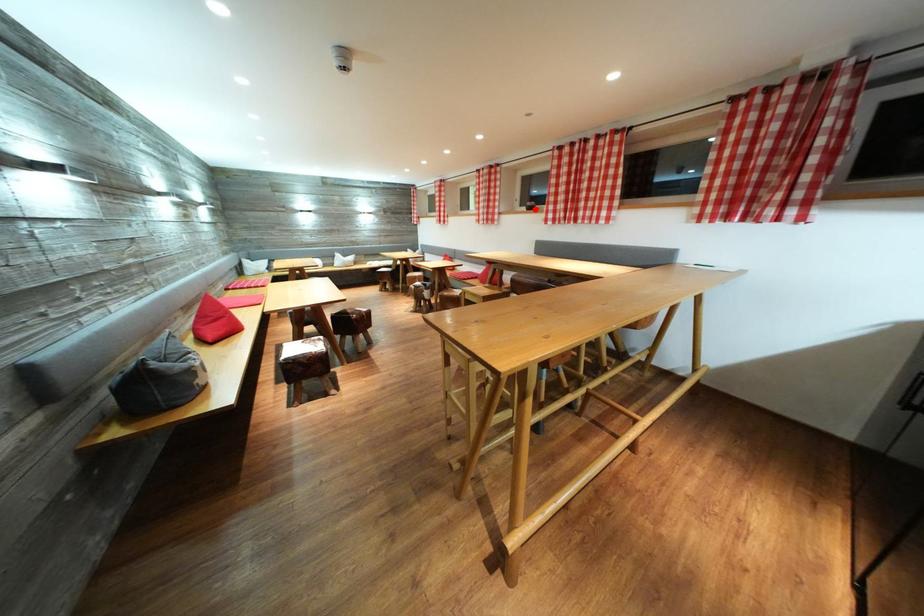
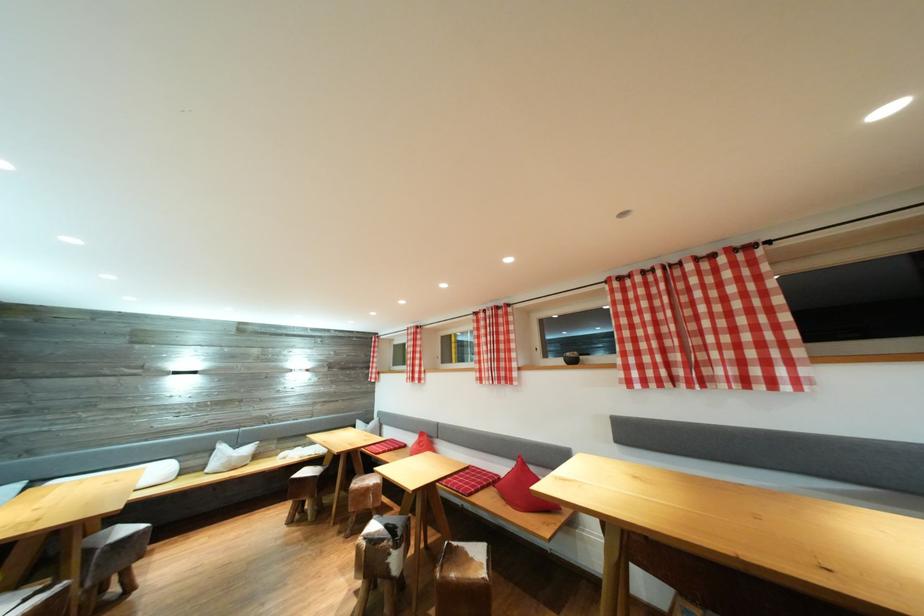
Question: I am providing you with two images of the same scene from different viewpoints. A red point is shown in image1. For the corresponding object point in image2, is it positioned nearer or farther from the camera?

Choices:
 (A) Nearer
 (B) Farther

Answer: (B)